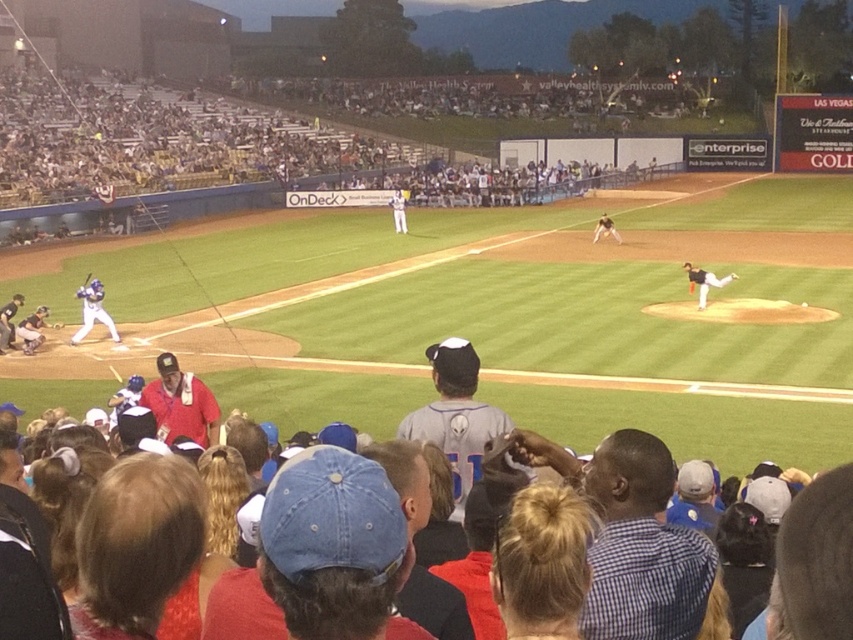
You are a photographer standing at the edge of the baseball field. You want to take a photo of the white uniform at center. The stadium has a rule that you can only take photos from the point with coordinates exactly at the center of the field. The center of the field is at point 0.5, 0.5. Is the point you are currently standing at, point (398,211), close enough to the center to take the photo?

The point (398,211) corresponds to the white uniform at center, but the center of the field is at 0.5, 0.5. Since the coordinates are not exactly the same, you are not at the center and cannot take the photo.